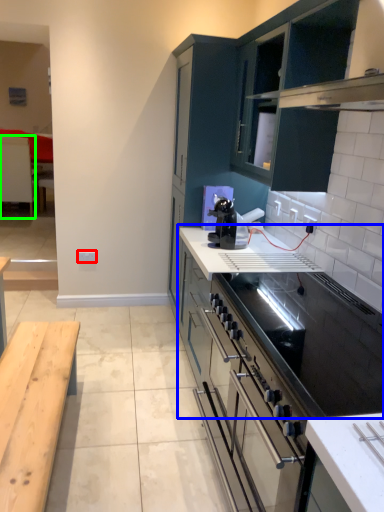
Question: Which object is the closest to the electric outlet (highlighted by a red box)? Choose among these: countertop (highlighted by a blue box) or table (highlighted by a green box).

Choices:
 (A) countertop
 (B) table

Answer: (A)